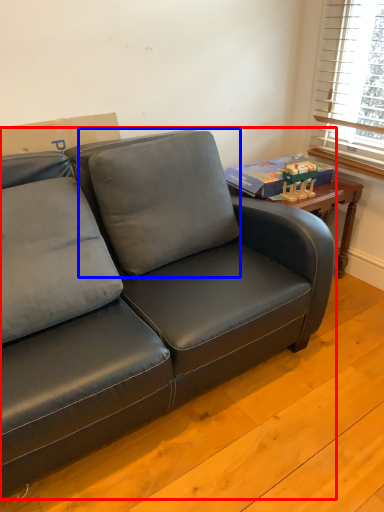
Question: Which object appears closest to the camera in this image, studio couch (highlighted by a red box) or pillow (highlighted by a blue box)?

Choices:
 (A) studio couch
 (B) pillow

Answer: (A)